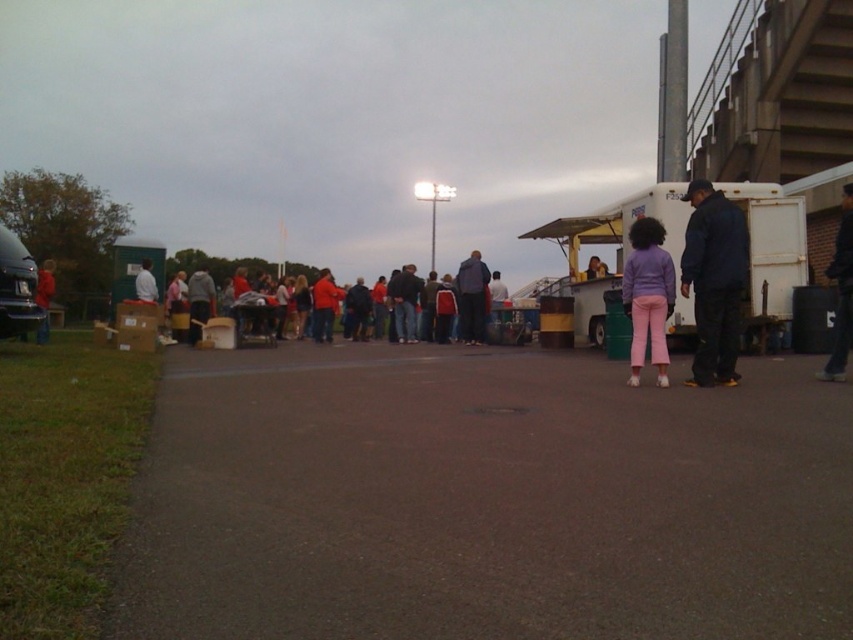
You are at the event and want to take a photo of the matte red jacket at center without the red fabric crowd at center blocking the view. Is there a way to do this by moving in a specific direction?

The red fabric crowd at center is in front of the matte red jacket at center, so moving behind the crowd could allow you to see the matte red jacket at center without obstruction.

Where is the red fabric crowd at center located in the image?

The red fabric crowd at center is located at point 0.419 on the x axis and 0.254 on the y axis.